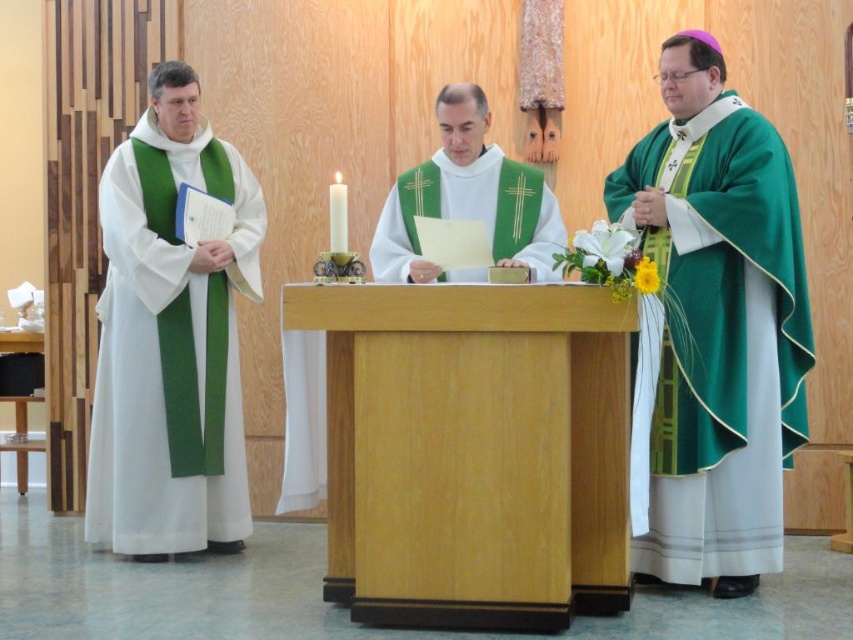
Is white matte vestment at left bigger than green satin vestment at center?

Yes, white matte vestment at left is bigger than green satin vestment at center.

Does point (132, 506) lie behind point (492, 230)?

Yes, point (132, 506) is farther from viewer.

Measure the distance between point (108, 477) and camera.

Point (108, 477) is 4.47 meters away from camera.

You are a GUI agent. You are given a task and a screenshot of the screen. Output one action in this format:
    pyautogui.click(x=<x>, y=<y>)
    Task: Click on the white matte vestment at left
    The image size is (853, 640).
    Given the screenshot: What is the action you would take?
    pyautogui.click(x=170, y=352)

Does point (648, 522) come closer to viewer compared to point (137, 195)?

Yes, it is.

Can you confirm if green satin robe at right is taller than white matte vestment at left?

No, green satin robe at right is not taller than white matte vestment at left.

Is point (759, 394) closer to viewer compared to point (131, 140)?

That is True.

Find the location of a particular element. green satin robe at right is located at coordinates (715, 342).

Between point (434, 436) and point (190, 328), which one is positioned behind?

The point (190, 328) is behind.

Which is above, light wood pulpit at center or white matte vestment at left?

white matte vestment at left

Identify the location of light wood pulpit at center. (473, 451).

Where is `light wood pulpit at center`? The image size is (853, 640). light wood pulpit at center is located at coordinates (473, 451).